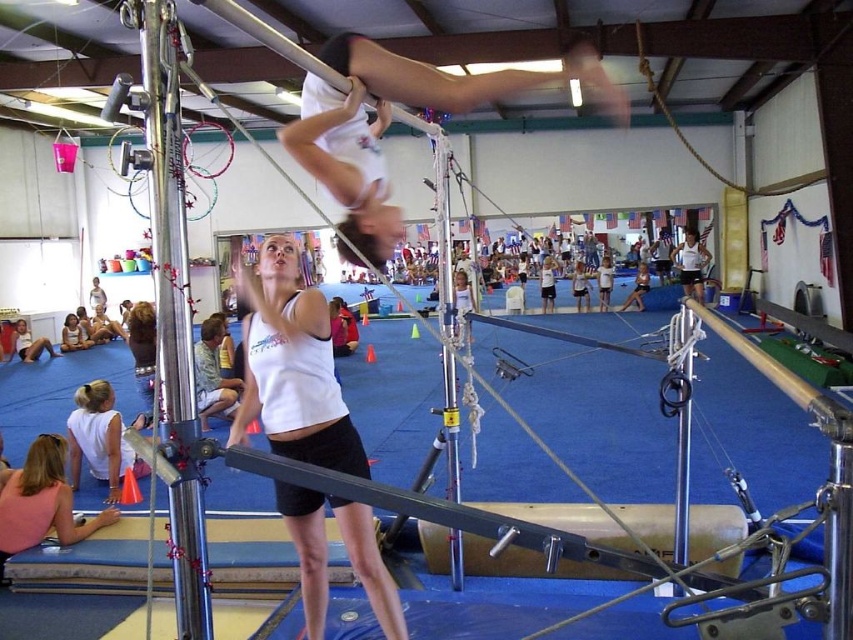
Is white tank top at lower left shorter than white glossy pole at upper center?

Incorrect, white tank top at lower left's height does not fall short of white glossy pole at upper center's.

Is white tank top at lower left closer to camera compared to white glossy pole at upper center?

No, it is not.

Between point (84, 406) and point (222, 12), which one is positioned behind?

The point (84, 406) is behind.

Find the location of a particular element. white tank top at lower left is located at coordinates (99, 440).

What do you see at coordinates (292, 368) in the screenshot? Image resolution: width=853 pixels, height=640 pixels. I see `white matte tank top at center` at bounding box center [292, 368].

Can you confirm if white matte tank top at center is positioned to the right of white tank top at lower left?

Correct, you'll find white matte tank top at center to the right of white tank top at lower left.

In order to click on white matte tank top at center in this screenshot , I will do `click(292, 368)`.

Between point (183, 360) and point (254, 24), which one is positioned in front?

Positioned in front is point (183, 360).

Between point (184, 294) and point (238, 8), which one is positioned in front?

Positioned in front is point (184, 294).

This screenshot has height=640, width=853. What are the coordinates of `polished silver pole at center` in the screenshot? It's located at (173, 321).